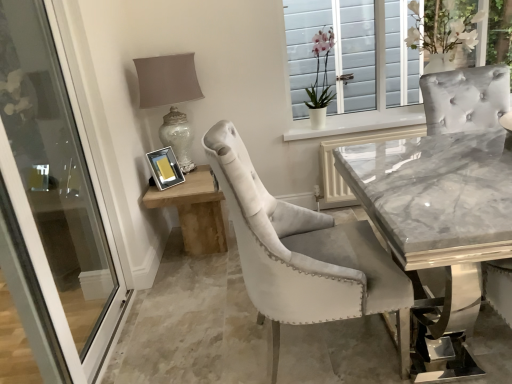
In order to face white marble shutter at upper right, should I rotate leftwards or rightwards?

A 21.043 degree turn to the right will do.

The height and width of the screenshot is (384, 512). What do you see at coordinates (195, 210) in the screenshot?
I see `wooden side table at lower left` at bounding box center [195, 210].

Measure the distance between metallic silver picture frame at upper center and camera.

A distance of 8.65 feet exists between metallic silver picture frame at upper center and camera.

From the picture: What is the approximate height of pink velvet orchid at upper center?

pink velvet orchid at upper center is 26.70 inches tall.

In order to face pink velvet orchid at upper center, should I rotate leftwards or rightwards?

Turn right by 8.671 degrees to look at pink velvet orchid at upper center.

At what (x,y) coordinates should I click in order to perform the action: click on velvet chair at center. Please return your answer as a coordinate pair (x, y). Looking at the image, I should click on (193, 325).

Does pink velvet orchid at upper center lie behind wooden side table at lower left?

That is True.

Can you confirm if pink velvet orchid at upper center is wider than wooden side table at lower left?

Incorrect, the width of pink velvet orchid at upper center does not surpass that of wooden side table at lower left.

From a real-world perspective, between pink velvet orchid at upper center and wooden side table at lower left, who is vertically lower?

wooden side table at lower left, from a real-world perspective.

Is pink velvet orchid at upper center aimed at wooden side table at lower left?

No, pink velvet orchid at upper center is not facing towards wooden side table at lower left.

Is white glass door at left oriented towards metallic silver picture frame at upper center?

No, white glass door at left is not oriented towards metallic silver picture frame at upper center.

Which is nearer, (25, 52) or (157, 164)?

Point (25, 52).

Is white glass door at left directly adjacent to metallic silver picture frame at upper center?

No, white glass door at left is not touching metallic silver picture frame at upper center.

From a real-world perspective, which is physically above, white glass door at left or matte silver table lamp at upper left?

matte silver table lamp at upper left.

Is white glass door at left far from matte silver table lamp at upper left?

white glass door at left is near matte silver table lamp at upper left, not far away.

Considering the relative positions of white glass door at left and matte silver table lamp at upper left in the image provided, is white glass door at left to the right of matte silver table lamp at upper left from the viewer's perspective?

No.

Consider the image. Considering the sizes of objects white glass door at left and matte silver table lamp at upper left in the image provided, who is shorter, white glass door at left or matte silver table lamp at upper left?

matte silver table lamp at upper left.

Is pink velvet orchid at upper center taller or shorter than metallic silver picture frame at upper center?

In the image, pink velvet orchid at upper center appears to be taller than metallic silver picture frame at upper center.

Considering their positions, is pink velvet orchid at upper center located in front of or behind metallic silver picture frame at upper center?

In the image, pink velvet orchid at upper center appears behind metallic silver picture frame at upper center.

Is pink velvet orchid at upper center to the right of metallic silver picture frame at upper center from the viewer's perspective?

Yes.

Considering the sizes of pink velvet orchid at upper center and metallic silver picture frame at upper center in the image, is pink velvet orchid at upper center wider or thinner than metallic silver picture frame at upper center?

Clearly, pink velvet orchid at upper center has more width compared to metallic silver picture frame at upper center.

In terms of height, does metallic silver picture frame at upper center look taller or shorter compared to wooden side table at lower left?

Clearly, metallic silver picture frame at upper center is shorter compared to wooden side table at lower left.

Considering the positions of objects metallic silver picture frame at upper center and wooden side table at lower left in the image provided, who is more to the right, metallic silver picture frame at upper center or wooden side table at lower left?

wooden side table at lower left.

Is metallic silver picture frame at upper center turned away from wooden side table at lower left?

That's not correct — metallic silver picture frame at upper center is not looking away from wooden side table at lower left.

From a real-world perspective, is pink velvet orchid at upper center located higher than white glass door at left?

Indeed, from a real-world perspective, pink velvet orchid at upper center stands above white glass door at left.

Can you confirm if pink velvet orchid at upper center is thinner than white glass door at left?

In fact, pink velvet orchid at upper center might be wider than white glass door at left.

Which is in front, pink velvet orchid at upper center or white glass door at left?

Positioned in front is white glass door at left.

Does pink velvet orchid at upper center have a smaller size compared to white glass door at left?

Yes.

How distant is metallic silver picture frame at upper center from white glass door at left?

metallic silver picture frame at upper center and white glass door at left are 31.12 inches apart.

In terms of width, does metallic silver picture frame at upper center look wider or thinner when compared to white glass door at left?

metallic silver picture frame at upper center is wider than white glass door at left.

This screenshot has width=512, height=384. I want to click on door on the left of metallic silver picture frame at upper center, so click(50, 217).

Does metallic silver picture frame at upper center have a greater height compared to white glass door at left?

No.

The width and height of the screenshot is (512, 384). Identify the location of table lying below the pink velvet orchid at upper center (from the image's perspective). (195, 210).

Where is `door that appears above the metallic silver picture frame at upper center (from a real-world perspective)`? Image resolution: width=512 pixels, height=384 pixels. door that appears above the metallic silver picture frame at upper center (from a real-world perspective) is located at coordinates click(50, 217).

Looking at this image, based on their spatial positions, is wooden side table at lower left or pink velvet orchid at upper center closer to metallic silver picture frame at upper center?

Among the two, wooden side table at lower left is located nearer to metallic silver picture frame at upper center.

Which object lies further to the anchor point wooden side table at lower left, white marble shutter at upper right or velvet chair at center?

white marble shutter at upper right.

Based on their spatial positions, is matte silver table lamp at upper left or metallic silver picture frame at upper center closer to white glass door at left?

Among the two, metallic silver picture frame at upper center is located nearer to white glass door at left.

Looking at the image, which one is located closer to matte silver table lamp at upper left, velvet chair at center or white marble shutter at upper right?

velvet chair at center is closer to matte silver table lamp at upper left.

When comparing their distances from matte silver table lamp at upper left, does white marble shutter at upper right or wooden side table at lower left seem further?

Based on the image, white marble shutter at upper right appears to be further to matte silver table lamp at upper left.

From the image, which object appears to be farther from wooden side table at lower left, pink velvet orchid at upper center or velvet chair at center?

The object further to wooden side table at lower left is pink velvet orchid at upper center.

Considering their positions, is metallic silver picture frame at upper center positioned closer to velvet chair at center than wooden side table at lower left?

wooden side table at lower left lies closer to velvet chair at center than the other object.

Which object lies further to the anchor point velvet chair at center, metallic silver picture frame at upper center or white glass door at left?

metallic silver picture frame at upper center is further to velvet chair at center.

The image size is (512, 384). Find the location of `picture frame located between velvet chair at center and wooden side table at lower left in the depth direction`. picture frame located between velvet chair at center and wooden side table at lower left in the depth direction is located at coordinates (165, 168).

Identify the location of floral arrangement located between metallic silver picture frame at upper center and white marble shutter at upper right in the left-right direction. (319, 71).

Find the location of `floral arrangement situated between wooden side table at lower left and white marble shutter at upper right from left to right`. floral arrangement situated between wooden side table at lower left and white marble shutter at upper right from left to right is located at coordinates (319, 71).

Where is `table positioned between white glass door at left and white marble shutter at upper right from near to far`? The height and width of the screenshot is (384, 512). table positioned between white glass door at left and white marble shutter at upper right from near to far is located at coordinates (195, 210).